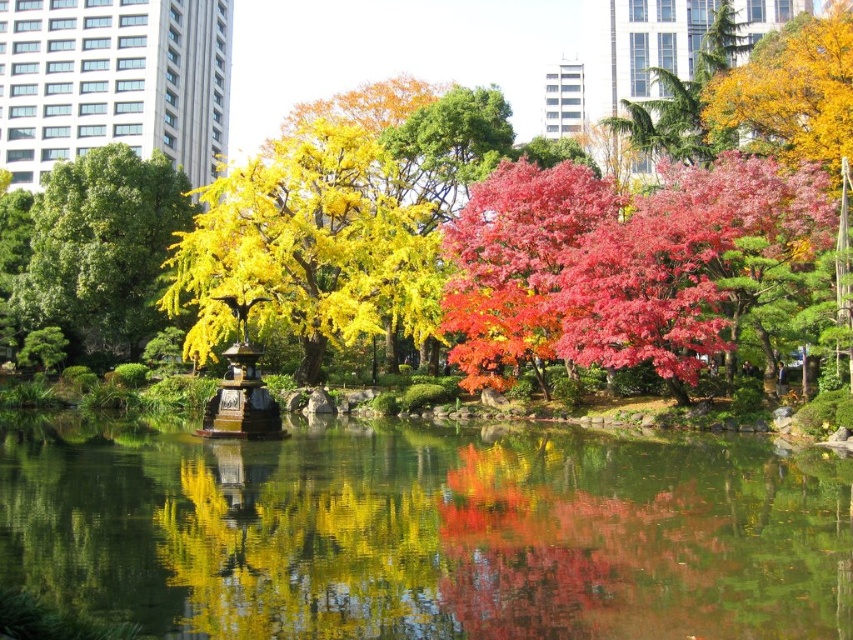
Who is taller, pink glossy maple at center right or green leafy tree at left?

green leafy tree at left

Measure the distance between point (653, 211) and camera.

Point (653, 211) and camera are 54.15 meters apart from each other.

Does point (494, 323) lie in front of point (149, 209)?

Yes, point (494, 323) is in front of point (149, 209).

At what (x,y) coordinates should I click in order to perform the action: click on pink glossy maple at center right. Please return your answer as a coordinate pair (x, y). Image resolution: width=853 pixels, height=640 pixels. Looking at the image, I should click on (610, 262).

Who is higher up, green reflective water at center or pink glossy maple at center right?

Positioned higher is pink glossy maple at center right.

Does green reflective water at center appear on the right side of pink glossy maple at center right?

Incorrect, green reflective water at center is not on the right side of pink glossy maple at center right.

Between point (715, 483) and point (740, 188), which one is positioned in front?

Point (715, 483)

Find the location of a particular element. This screenshot has width=853, height=640. green reflective water at center is located at coordinates (x=428, y=532).

Is point (595, 184) positioned before point (335, 230)?

Yes, it is.

Does pink glossy maple at center right have a smaller size compared to golden yellow leaves at center?

Yes.

The width and height of the screenshot is (853, 640). What are the coordinates of `pink glossy maple at center right` in the screenshot? It's located at point(610,262).